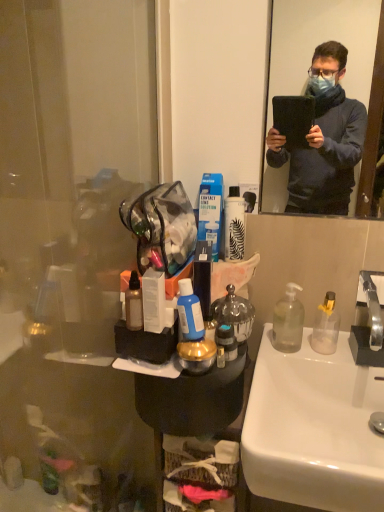
What do you see at coordinates (189, 313) in the screenshot?
I see `blue matte bottle at center, which is the 2th toiletries in left-to-right order` at bounding box center [189, 313].

What is the approximate width of blue matte bottle at center, which is counted as the second toiletries, starting from the right?

2.37 inches.

You are a GUI agent. You are given a task and a screenshot of the screen. Output one action in this format:
    pyautogui.click(x=<x>, y=<y>)
    Task: Click on the translucent plastic bottle at center, which is the first toiletries from right to left
    The image size is (384, 512).
    Given the screenshot: What is the action you would take?
    pyautogui.click(x=227, y=341)

Image resolution: width=384 pixels, height=512 pixels. What do you see at coordinates (72, 217) in the screenshot?
I see `transparent plastic glass door at left` at bounding box center [72, 217].

This screenshot has height=512, width=384. Describe the element at coordinates (288, 321) in the screenshot. I see `clear plastic soap dispenser at right, marked as the first bottle in a left-to-right arrangement` at that location.

This screenshot has height=512, width=384. I want to click on white matte spray can at center, so click(234, 225).

Find the location of a particular element. The width and height of the screenshot is (384, 512). white glossy sink at lower right is located at coordinates (314, 428).

The width and height of the screenshot is (384, 512). Find the location of `blue matte bottle at center, which is counted as the second toiletries, starting from the right`. blue matte bottle at center, which is counted as the second toiletries, starting from the right is located at coordinates (189, 313).

Are metallic silver spray can at center, which is the first toiletries from left to right, and translucent plastic bottle at sink, the second bottle in the left-to-right sequence, beside each other?

No, metallic silver spray can at center, which is the first toiletries from left to right, is not in contact with translucent plastic bottle at sink, the second bottle in the left-to-right sequence.

Which is correct: metallic silver spray can at center, which is the first toiletries from left to right, is inside translucent plastic bottle at sink, which ranks as the first bottle in right-to-left order, or outside of it?

metallic silver spray can at center, which is the first toiletries from left to right, is spatially situated outside translucent plastic bottle at sink, which ranks as the first bottle in right-to-left order.

Considering the points (131, 292) and (338, 328), which point is behind, point (131, 292) or point (338, 328)?

Point (338, 328)

Does metallic silver spray can at center, which is the first toiletries from left to right, have a greater width compared to translucent plastic bottle at sink, which ranks as the first bottle in right-to-left order?

In fact, metallic silver spray can at center, which is the first toiletries from left to right, might be narrower than translucent plastic bottle at sink, which ranks as the first bottle in right-to-left order.

From the image's perspective, which object appears higher, silver metallic faucet at right or white glossy sink at lower right?

silver metallic faucet at right appears higher in the image.

From the picture: Measure the distance between silver metallic faucet at right and white glossy sink at lower right.

11.05 inches.

Is silver metallic faucet at right not inside white glossy sink at lower right?

Yes, silver metallic faucet at right is not within white glossy sink at lower right.

Is silver metallic faucet at right smaller than white glossy sink at lower right?

Yes, silver metallic faucet at right is smaller than white glossy sink at lower right.

From a real-world perspective, who is located lower, metallic silver spray can at center, the 3th toiletries from the right, or white glossy sink at lower right?

In real-world perspective, white glossy sink at lower right is lower.

In the image, is metallic silver spray can at center, the 3th toiletries from the right, positioned in front of or behind white glossy sink at lower right?

metallic silver spray can at center, the 3th toiletries from the right, is positioned farther from the viewer than white glossy sink at lower right.

From the picture: Is metallic silver spray can at center, the 3th toiletries from the right, touching white glossy sink at lower right?

No, metallic silver spray can at center, the 3th toiletries from the right, is not beside white glossy sink at lower right.

Which of these two, metallic silver spray can at center, which is the first toiletries from left to right, or white glossy sink at lower right, is wider?

white glossy sink at lower right.

Which is in front, point (263, 462) or point (183, 290)?

The point (263, 462) is in front.

Considering the sizes of objects white glossy sink at lower right and blue matte bottle at center, which is the 2th toiletries in left-to-right order, in the image provided, who is thinner, white glossy sink at lower right or blue matte bottle at center, which is the 2th toiletries in left-to-right order,?

With smaller width is blue matte bottle at center, which is the 2th toiletries in left-to-right order.

Does white glossy sink at lower right lie in front of blue matte bottle at center, which is counted as the second toiletries, starting from the right?

Yes, it is.

Could you tell me if metallic fabric handbag at upper left is turned towards translucent plastic bottle at center, which is the first toiletries from right to left?

No.

Considering the positions of objects metallic fabric handbag at upper left and translucent plastic bottle at center, which is the first toiletries from right to left, in the image provided, who is more to the right, metallic fabric handbag at upper left or translucent plastic bottle at center, which is the first toiletries from right to left,?

translucent plastic bottle at center, which is the first toiletries from right to left.

How much distance is there between metallic fabric handbag at upper left and translucent plastic bottle at center, which is the first toiletries from right to left?

The distance of metallic fabric handbag at upper left from translucent plastic bottle at center, which is the first toiletries from right to left, is 9.85 inches.

Can you confirm if metallic fabric handbag at upper left is thinner than translucent plastic bottle at center, which is the first toiletries from right to left?

No, metallic fabric handbag at upper left is not thinner than translucent plastic bottle at center, which is the first toiletries from right to left.

Considering the sizes of objects silver metallic faucet at right and translucent plastic bottle at center, the 3th toiletries from the left, in the image provided, who is bigger, silver metallic faucet at right or translucent plastic bottle at center, the 3th toiletries from the left,?

silver metallic faucet at right is bigger.

Is point (367, 276) closer or farther from the camera than point (228, 343)?

Point (367, 276) is farther from the camera than point (228, 343).

Does point (64, 253) appear closer or farther from the camera than point (380, 335)?

Point (64, 253).

Which of these two, transparent plastic glass door at left or silver metallic faucet at right, is smaller?

silver metallic faucet at right.

From the image's perspective, is transparent plastic glass door at left positioned above or below silver metallic faucet at right?

transparent plastic glass door at left is situated lower than silver metallic faucet at right in the image.

You are a GUI agent. You are given a task and a screenshot of the screen. Output one action in this format:
    pyautogui.click(x=<x>, y=<y>)
    Task: Click on the 2nd toiletries positioned above the translucent plastic bottle at sink, the second bottle in the left-to-right sequence (from a real-world perspective)
    Image resolution: width=384 pixels, height=512 pixels.
    Given the screenshot: What is the action you would take?
    pyautogui.click(x=134, y=303)

This screenshot has width=384, height=512. What are the coordinates of `sink in front of the silver metallic faucet at right` in the screenshot? It's located at (314, 428).

Based on their spatial positions, is transparent plastic glass door at left or clear plastic soap dispenser at right, marked as the first bottle in a left-to-right arrangement, further from metallic fabric handbag at upper left?

Among the two, transparent plastic glass door at left is located further to metallic fabric handbag at upper left.

When comparing their distances from clear plastic soap dispenser at right, marked as the first bottle in a left-to-right arrangement, does blue matte bottle at center, which is counted as the second toiletries, starting from the right, or translucent plastic bottle at sink, which ranks as the first bottle in right-to-left order, seem closer?

translucent plastic bottle at sink, which ranks as the first bottle in right-to-left order.

Estimate the real-world distances between objects in this image. Which object is closer to metallic fabric handbag at upper left, blue matte bottle at center, which is counted as the second toiletries, starting from the right, or transparent plastic glass door at left?

blue matte bottle at center, which is counted as the second toiletries, starting from the right, lies closer to metallic fabric handbag at upper left than the other object.

Based on their spatial positions, is clear plastic soap dispenser at right, the second bottle in the right-to-left sequence, or translucent plastic bottle at center, which is the first toiletries from right to left, further from translucent plastic bottle at sink, the second bottle in the left-to-right sequence?

translucent plastic bottle at center, which is the first toiletries from right to left, is further to translucent plastic bottle at sink, the second bottle in the left-to-right sequence.

Looking at the image, which one is located further to white matte spray can at center, translucent plastic bottle at center, which is the first toiletries from right to left, or white glossy sink at lower right?

white glossy sink at lower right.

Looking at this image, looking at the image, which one is located closer to translucent plastic bottle at center, the 3th toiletries from the left, white glossy sink at lower right or blue matte bottle at center, which is counted as the second toiletries, starting from the right?

blue matte bottle at center, which is counted as the second toiletries, starting from the right, is positioned closer to the anchor translucent plastic bottle at center, the 3th toiletries from the left.

Based on the photo, from the image, which object appears to be nearer to transparent plastic glass door at left, white matte spray can at center or blue matte bottle at center, which is counted as the second toiletries, starting from the right?

Among the two, white matte spray can at center is located nearer to transparent plastic glass door at left.

From the image, which object appears to be farther from clear plastic soap dispenser at right, marked as the first bottle in a left-to-right arrangement, white glossy sink at lower right or metallic fabric handbag at upper left?

The object further to clear plastic soap dispenser at right, marked as the first bottle in a left-to-right arrangement, is metallic fabric handbag at upper left.

This screenshot has height=512, width=384. Find the location of `toiletries between transparent plastic glass door at left and metallic silver spray can at center, the 3th toiletries from the right, in the front-back direction`. toiletries between transparent plastic glass door at left and metallic silver spray can at center, the 3th toiletries from the right, in the front-back direction is located at coordinates (189, 313).

Find the location of `handbag between transparent plastic glass door at left and white matte spray can at center along the z-axis`. handbag between transparent plastic glass door at left and white matte spray can at center along the z-axis is located at coordinates coord(161,227).

Identify the location of glass door that lies between metallic fabric handbag at upper left and white glossy sink at lower right from top to bottom. This screenshot has height=512, width=384. (72, 217).

What are the coordinates of `toiletries between blue matte bottle at center, which is counted as the second toiletries, starting from the right, and silver metallic faucet at right from left to right` in the screenshot? It's located at (227, 341).